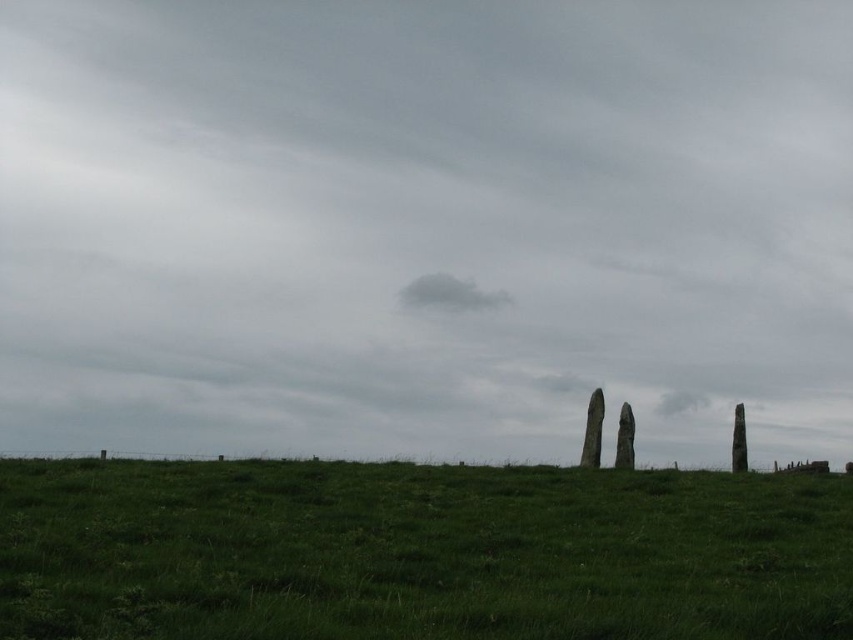
Question: Based on their relative distances, which object is farther from the green grassy field at lower center?

Choices:
 (A) gray cloudy sky at upper center
 (B) gray cotton cloud at center

Answer: (B)

Question: Which point appears closest to the camera in this image?

Choices:
 (A) (457, 308)
 (B) (178, 506)
 (C) (640, 291)

Answer: (B)

Question: Is gray cloudy sky at upper center to the right of gray cotton cloud at center from the viewer's perspective?

Choices:
 (A) yes
 (B) no

Answer: (B)

Question: Is green grassy field at lower center to the left of gray cotton cloud at center from the viewer's perspective?

Choices:
 (A) yes
 (B) no

Answer: (A)

Question: Which of the following is the farthest from the observer?

Choices:
 (A) click(x=485, y=296)
 (B) click(x=590, y=173)
 (C) click(x=801, y=566)

Answer: (B)

Question: Can you confirm if green grassy field at lower center is positioned to the left of gray cotton cloud at center?

Choices:
 (A) yes
 (B) no

Answer: (A)